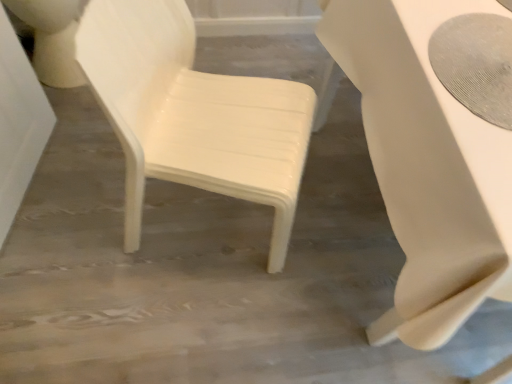
The image size is (512, 384). I want to click on vacant area situated to the left side of white glossy chair at center, so click(x=73, y=207).